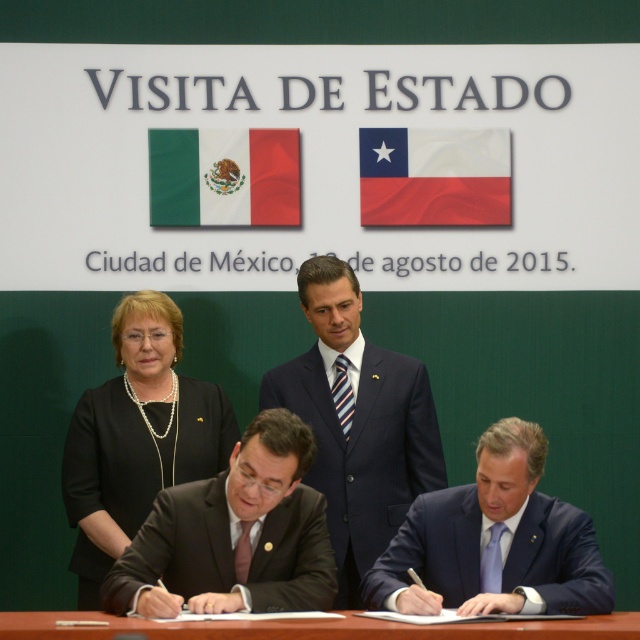
Which is in front, point (429, 547) or point (436, 166)?

Point (429, 547)

Is point (465, 550) closer to viewer compared to point (380, 209)?

Yes.

Identify the location of light blue satin business suit at lower right. (432, 548).

Who is more distant from viewer, [276,369] or [49,624]?

Positioned behind is point [276,369].

Which is below, dark blue pinstripe suit at center or brown wooden table at lower center?

brown wooden table at lower center is below.

This screenshot has width=640, height=640. I want to click on dark blue pinstripe suit at center, so click(x=364, y=451).

Who is lower down, dark blue pinstripe suit at center or red fabric chilean flag at center?

dark blue pinstripe suit at center is below.

Who is positioned more to the right, dark blue pinstripe suit at center or red fabric chilean flag at center?

Positioned to the right is red fabric chilean flag at center.

Is point (285, 387) closer to viewer compared to point (392, 202)?

That is True.

In order to click on dark blue pinstripe suit at center in this screenshot , I will do `click(364, 451)`.